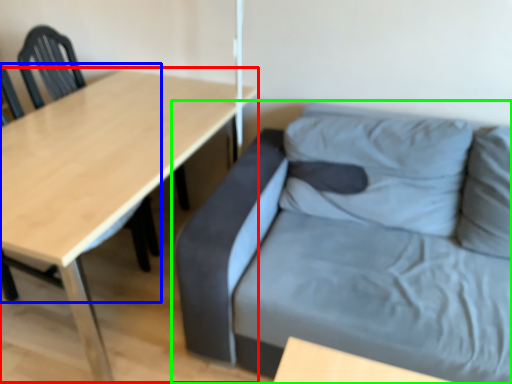
Question: Considering the real-world distances, which object is closest to table (highlighted by a red box)? chair (highlighted by a blue box) or studio couch (highlighted by a green box).

Choices:
 (A) chair
 (B) studio couch

Answer: (A)